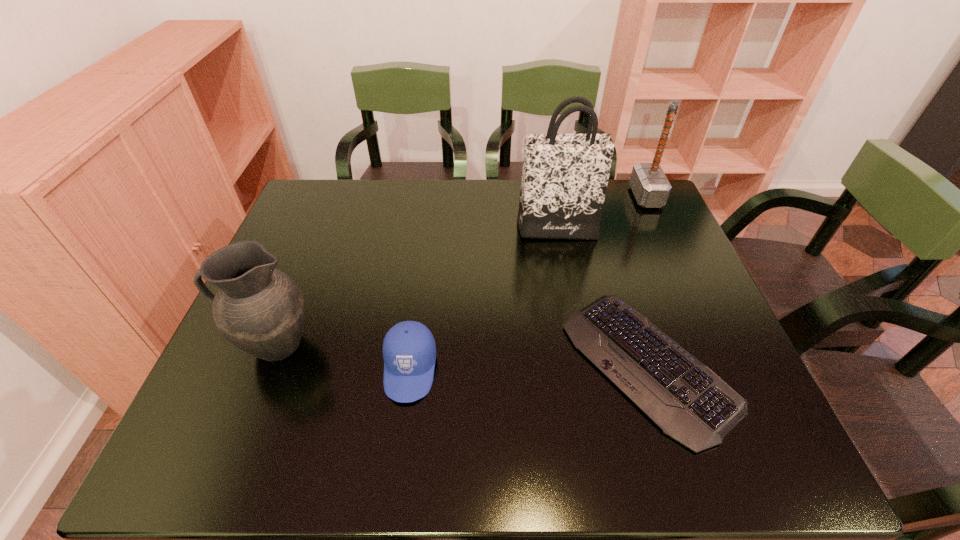
Identify the location of free space between the hammer and the second shortest object. (528, 283).

This screenshot has height=540, width=960. What are the coordinates of `vacant space that is in between the hammer and the pitcher` in the screenshot? It's located at (461, 271).

The height and width of the screenshot is (540, 960). I want to click on unoccupied position between the computer keyboard and the hammer, so click(646, 281).

Identify the location of unoccupied area between the leftmost object and the computer keyboard. This screenshot has width=960, height=540. (462, 355).

Where is `free space that is in between the farthest object and the leftmost object`? free space that is in between the farthest object and the leftmost object is located at coordinates (461, 271).

The height and width of the screenshot is (540, 960). Find the location of `object that is the closest to the fourth tallest object`. object that is the closest to the fourth tallest object is located at coordinates coord(259,309).

Find the location of a particular element. This screenshot has height=540, width=960. object that is the fourth closest to the leftmost object is located at coordinates (650, 186).

Where is `free space in the image that satisfies the following two spatial constraints: 1. on the side of the pitcher with the handle; 2. on the back side of the computer keyboard`? This screenshot has height=540, width=960. free space in the image that satisfies the following two spatial constraints: 1. on the side of the pitcher with the handle; 2. on the back side of the computer keyboard is located at coordinates (267, 366).